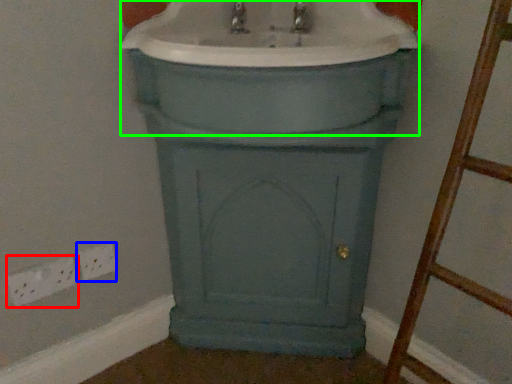
Question: Considering the real-world distances, which object is closest to electric outlet (highlighted by a red box)? electric outlet (highlighted by a blue box) or sink (highlighted by a green box).

Choices:
 (A) electric outlet
 (B) sink

Answer: (A)